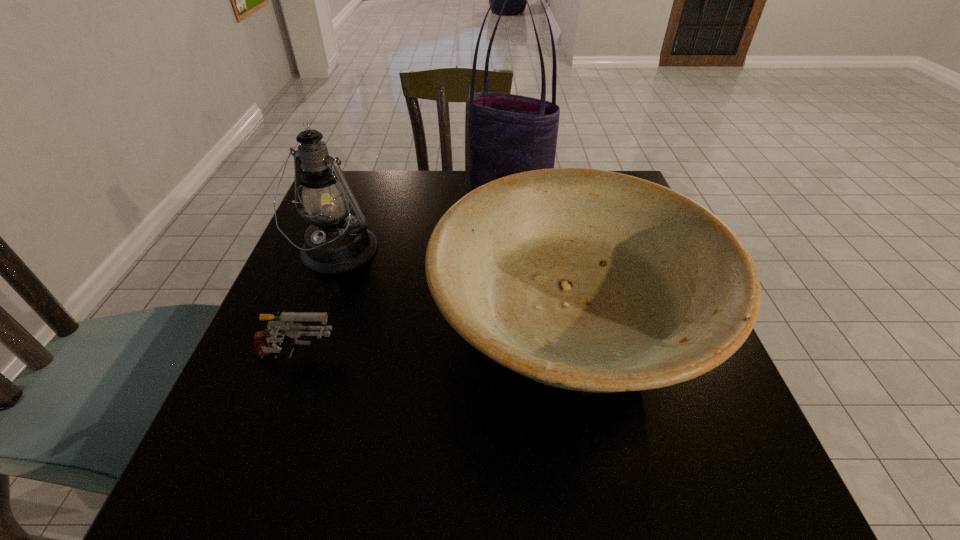
Identify the location of vacant point located between the tallest object and the gun. This screenshot has width=960, height=540. (402, 276).

You are a GUI agent. You are given a task and a screenshot of the screen. Output one action in this format:
    pyautogui.click(x=<x>, y=<y>)
    Task: Click on the empty space that is in between the farthest object and the gun
    The height and width of the screenshot is (540, 960).
    Given the screenshot: What is the action you would take?
    (402, 276)

Locate an element on the screen. The image size is (960, 540). unoccupied area between the dish and the shortest object is located at coordinates (432, 346).

At what (x,y) coordinates should I click in order to perform the action: click on vacant area that lies between the gun and the tallest object. Please return your answer as a coordinate pair (x, y). Looking at the image, I should click on (402, 276).

Image resolution: width=960 pixels, height=540 pixels. I want to click on blank region between the shortest object and the tallest object, so click(402, 276).

Where is `the third closest object to the gun`? Image resolution: width=960 pixels, height=540 pixels. the third closest object to the gun is located at coordinates (507, 134).

In order to click on object that is the second closest to the second tallest object in this screenshot , I will do `click(589, 280)`.

The width and height of the screenshot is (960, 540). I want to click on free space that satisfies the following two spatial constraints: 1. on the back side of the oil lamp; 2. on the right side of the farthest object, so click(x=358, y=194).